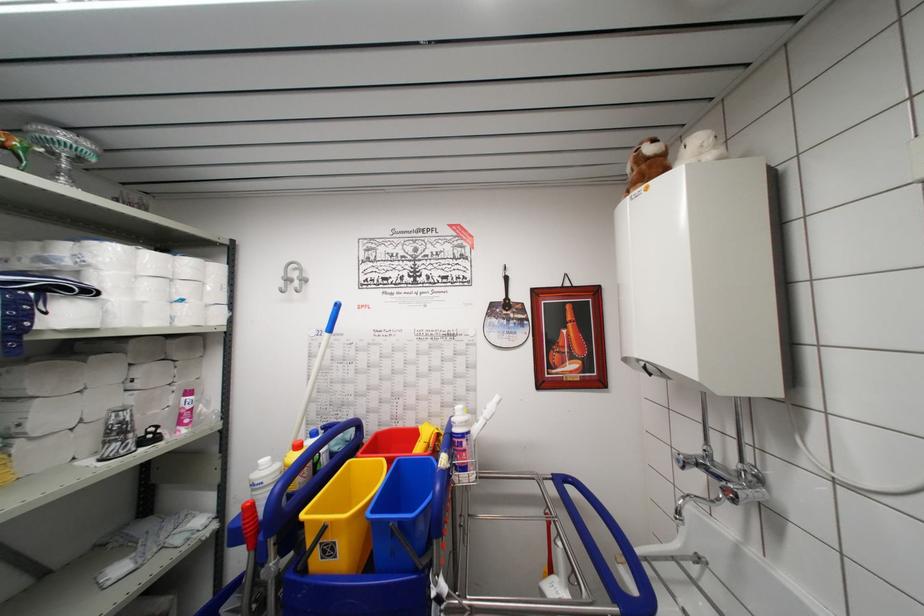
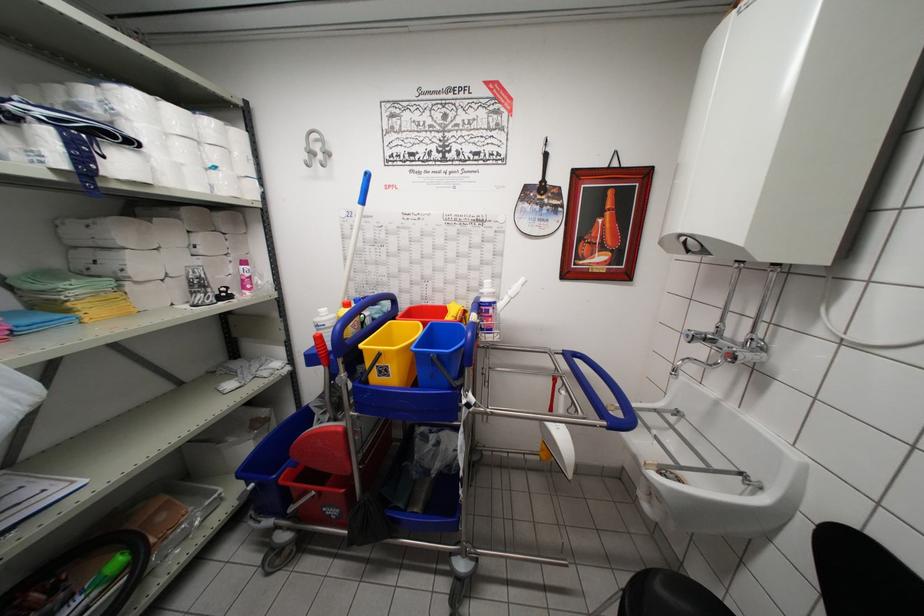
Question: Based on the continuous images, in which direction is the camera rotating? Reply with the corresponding letter.

Choices:
 (A) Left
 (B) Right
 (C) Up
 (D) Down

Answer: (D)